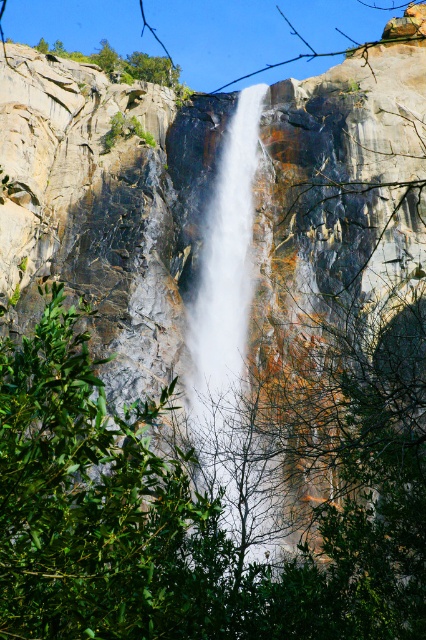
Question: Is green leafy tree at lower left wider than white smooth waterfall at center?

Choices:
 (A) yes
 (B) no

Answer: (A)

Question: Which point is closer to the camera?

Choices:
 (A) (236, 252)
 (B) (39, 340)

Answer: (B)

Question: Is green leafy tree at lower left bigger than white smooth waterfall at center?

Choices:
 (A) no
 (B) yes

Answer: (A)

Question: Does green leafy tree at lower left have a lesser width compared to white smooth waterfall at center?

Choices:
 (A) yes
 (B) no

Answer: (B)

Question: Which point is farther to the camera?

Choices:
 (A) green leafy tree at lower left
 (B) white smooth waterfall at center

Answer: (B)

Question: Among these objects, which one is nearest to the camera?

Choices:
 (A) white smooth waterfall at center
 (B) green leafy tree at lower left

Answer: (B)